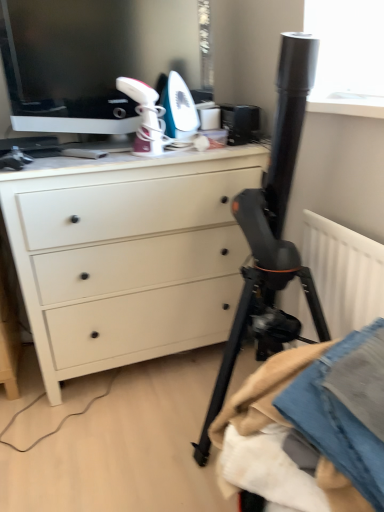
Image resolution: width=384 pixels, height=512 pixels. I want to click on denim fabric at lower right, so click(x=311, y=425).

What do you see at coordinates (97, 49) in the screenshot? I see `matte black monitor at upper left` at bounding box center [97, 49].

You are a GUI agent. You are given a task and a screenshot of the screen. Output one action in this format:
    pyautogui.click(x=<x>, y=<y>)
    Task: Click on the denim fabric at lower right
    
    Given the screenshot: What is the action you would take?
    pyautogui.click(x=311, y=425)

Visually, is matte black monitor at upper left positioned to the left or to the right of denim fabric at lower right?

From the image, it's evident that matte black monitor at upper left is to the left of denim fabric at lower right.

Is the position of matte black monitor at upper left less distant than that of denim fabric at lower right?

No.

From the image's perspective, is matte black monitor at upper left positioned above or below denim fabric at lower right?

Clearly, from the image's perspective, matte black monitor at upper left is above denim fabric at lower right.

Looking at this image, considering the relative sizes of matte black monitor at upper left and denim fabric at lower right in the image provided, is matte black monitor at upper left thinner than denim fabric at lower right?

Indeed, matte black monitor at upper left has a lesser width compared to denim fabric at lower right.

How much distance is there between white matte chest of drawers at center and denim fabric at lower right?

white matte chest of drawers at center and denim fabric at lower right are 34.38 inches apart from each other.

Based on the photo, between white matte chest of drawers at center and denim fabric at lower right, which one appears on the right side from the viewer's perspective?

denim fabric at lower right is more to the right.

At what (x,y) coordinates should I click in order to perform the action: click on chest of drawers above the denim fabric at lower right (from the image's perspective). Please return your answer as a coordinate pair (x, y). The width and height of the screenshot is (384, 512). Looking at the image, I should click on (128, 255).

Is white matte chest of drawers at center aimed at denim fabric at lower right?

Yes, white matte chest of drawers at center is turned towards denim fabric at lower right.

Is point (170, 52) less distant than point (42, 264)?

No, it is not.

Can you confirm if matte black monitor at upper left is wider than white matte chest of drawers at center?

No.

From the image's perspective, is matte black monitor at upper left located above or below white matte chest of drawers at center?

Clearly, from the image's perspective, matte black monitor at upper left is above white matte chest of drawers at center.

From a real-world perspective, which object rests below the other?

white matte chest of drawers at center, from a real-world perspective.

Is white matte chest of drawers at center to the left or to the right of matte black monitor at upper left in the image?

From the image, it's evident that white matte chest of drawers at center is to the right of matte black monitor at upper left.

Does point (153, 266) come closer to viewer compared to point (111, 6)?

That is False.

You are a GUI agent. You are given a task and a screenshot of the screen. Output one action in this format:
    pyautogui.click(x=<x>, y=<y>)
    Task: Click on the computer monitor above the white matte chest of drawers at center (from a real-world perspective)
    This screenshot has height=512, width=384.
    Given the screenshot: What is the action you would take?
    [x=97, y=49]

Considering the sizes of objects denim fabric at lower right and matte black monitor at upper left in the image provided, who is thinner, denim fabric at lower right or matte black monitor at upper left?

matte black monitor at upper left is thinner.

Which object is further away from the camera taking this photo, denim fabric at lower right or matte black monitor at upper left?

Positioned behind is matte black monitor at upper left.

Considering the points (354, 496) and (188, 76), which point is behind, point (354, 496) or point (188, 76)?

The point (188, 76) is farther.

Is denim fabric at lower right far away from white matte chest of drawers at center?

No, denim fabric at lower right is not far from white matte chest of drawers at center.

From the image's perspective, is denim fabric at lower right on top of white matte chest of drawers at center?

No, from the image's perspective, denim fabric at lower right is not above white matte chest of drawers at center.

Which of these two, denim fabric at lower right or white matte chest of drawers at center, is wider?

white matte chest of drawers at center is wider.

From a real-world perspective, is denim fabric at lower right positioned above or below white matte chest of drawers at center?

denim fabric at lower right is below white matte chest of drawers at center.

Where is `clothing that appears below the matte black monitor at upper left (from the image's perspective)`? clothing that appears below the matte black monitor at upper left (from the image's perspective) is located at coordinates (311, 425).

Identify the location of clothing that is under the white matte chest of drawers at center (from a real-world perspective). The width and height of the screenshot is (384, 512). (311, 425).

When comparing their distances from white matte chest of drawers at center, does denim fabric at lower right or matte black monitor at upper left seem further?

denim fabric at lower right lies further to white matte chest of drawers at center than the other object.

From the image, which object appears to be nearer to denim fabric at lower right, matte black monitor at upper left or white matte chest of drawers at center?

white matte chest of drawers at center.

Which object lies further to the anchor point denim fabric at lower right, white matte chest of drawers at center or matte black monitor at upper left?

The object further to denim fabric at lower right is matte black monitor at upper left.

Looking at the image, which one is located closer to matte black monitor at upper left, white matte chest of drawers at center or denim fabric at lower right?

white matte chest of drawers at center is closer to matte black monitor at upper left.

Estimate the real-world distances between objects in this image. Which object is further from white matte chest of drawers at center, matte black monitor at upper left or denim fabric at lower right?

Among the two, denim fabric at lower right is located further to white matte chest of drawers at center.

Considering their positions, is denim fabric at lower right positioned further to matte black monitor at upper left than white matte chest of drawers at center?

denim fabric at lower right lies further to matte black monitor at upper left than the other object.

Find the location of `chest of drawers between matte black monitor at upper left and denim fabric at lower right from top to bottom`. chest of drawers between matte black monitor at upper left and denim fabric at lower right from top to bottom is located at coordinates (128, 255).